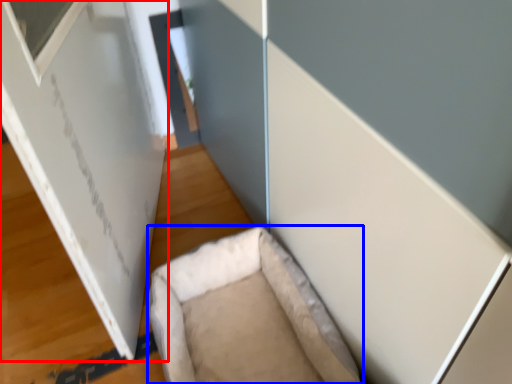
Question: Among these objects, which one is nearest to the camera, bulletin board (highlighted by a red box) or furniture (highlighted by a blue box)?

Choices:
 (A) bulletin board
 (B) furniture

Answer: (A)